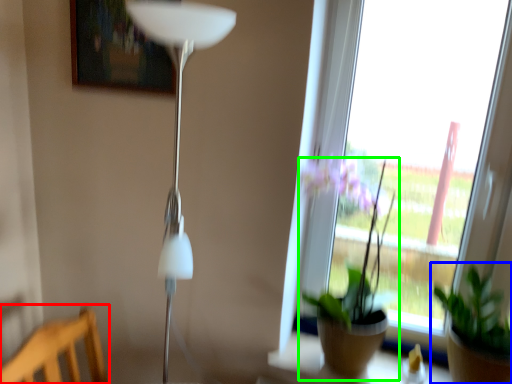
Question: Estimate the real-world distances between objects in this image. Which object is closer to furniture (highlighted by a red box), houseplant (highlighted by a blue box) or houseplant (highlighted by a green box)?

Choices:
 (A) houseplant
 (B) houseplant

Answer: (B)